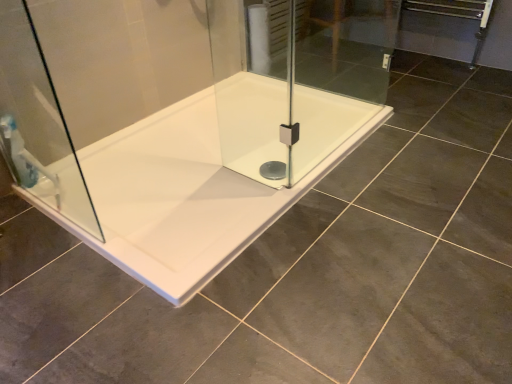
In order to face transparent glass shower door at left, should I rotate leftwards or rightwards?

You should rotate left by 28.793 degrees.

The image size is (512, 384). Describe the element at coordinates (183, 196) in the screenshot. I see `white glossy bathtub at center` at that location.

The image size is (512, 384). What do you see at coordinates (24, 158) in the screenshot?
I see `translucent plastic shower at left` at bounding box center [24, 158].

Where is `transparent glass shower door at left`? transparent glass shower door at left is located at coordinates (37, 123).

Which is behind, white glossy bathtub at center or translucent plastic shower at left?

translucent plastic shower at left is more distant.

Is point (79, 233) closer or farther from the camera than point (40, 170)?

Point (79, 233) appears to be closer to the viewer than point (40, 170).

Is white glossy bathtub at center placed right next to translucent plastic shower at left?

No, white glossy bathtub at center is not beside translucent plastic shower at left.

Find the location of a particular element. This screenshot has height=384, width=512. bathtub located on the right of translucent plastic shower at left is located at coordinates (183, 196).

Which is behind, point (330, 156) or point (44, 150)?

The point (330, 156) is behind.

Is the position of white glossy bathtub at center more distant than that of transparent glass shower door at left?

Yes, white glossy bathtub at center is behind transparent glass shower door at left.

Can you confirm if white glossy bathtub at center is smaller than transparent glass shower door at left?

No.

Considering the relative sizes of white glossy bathtub at center and transparent glass shower door at left in the image provided, is white glossy bathtub at center wider than transparent glass shower door at left?

Indeed, white glossy bathtub at center has a greater width compared to transparent glass shower door at left.

From a real-world perspective, is translucent plastic shower at left physically above white glossy bathtub at center?

Indeed, from a real-world perspective, translucent plastic shower at left stands above white glossy bathtub at center.

Does translucent plastic shower at left lie behind white glossy bathtub at center?

That is True.

Is translucent plastic shower at left next to white glossy bathtub at center and touching it?

translucent plastic shower at left is not next to white glossy bathtub at center, and they're not touching.

Could you tell me if translucent plastic shower at left is facing white glossy bathtub at center?

Yes, translucent plastic shower at left is turned towards white glossy bathtub at center.

Is translucent plastic shower at left oriented towards transparent glass shower door at left?

No, translucent plastic shower at left is not turned towards transparent glass shower door at left.

From a real-world perspective, is translucent plastic shower at left beneath transparent glass shower door at left?

Yes, from a real-world perspective, translucent plastic shower at left is below transparent glass shower door at left.

Is point (22, 149) positioned in front of point (25, 150)?

That is False.

Find the location of a particular element. shower behind the transparent glass shower door at left is located at coordinates (24, 158).

Is transparent glass shower door at left touching translucent plastic shower at left?

Yes, the surface of transparent glass shower door at left is in contact with translucent plastic shower at left.

Considering the sizes of transparent glass shower door at left and translucent plastic shower at left in the image, is transparent glass shower door at left wider or thinner than translucent plastic shower at left?

In the image, transparent glass shower door at left appears to be more narrow than translucent plastic shower at left.

This screenshot has height=384, width=512. What are the coordinates of `shower that is on the left side of transparent glass shower door at left` in the screenshot? It's located at (24, 158).

Can you confirm if transparent glass shower door at left is smaller than translucent plastic shower at left?

Incorrect, transparent glass shower door at left is not smaller in size than translucent plastic shower at left.

Is white glossy bathtub at center at the back of transparent glass shower door at left?

No, transparent glass shower door at left is not facing away from white glossy bathtub at center.

Find the location of a particular element. shower door lying above the white glossy bathtub at center (from the image's perspective) is located at coordinates (37, 123).

Is transparent glass shower door at left further to camera compared to white glossy bathtub at center?

No, it is in front of white glossy bathtub at center.

How many degrees apart are the facing directions of transparent glass shower door at left and white glossy bathtub at center?

The angle between the facing direction of transparent glass shower door at left and the facing direction of white glossy bathtub at center is 90 degrees.

Image resolution: width=512 pixels, height=384 pixels. I want to click on bathtub on the right of translucent plastic shower at left, so click(183, 196).

Locate an element on the screen. The width and height of the screenshot is (512, 384). bathtub behind the transparent glass shower door at left is located at coordinates pyautogui.click(x=183, y=196).

Considering their positions, is transparent glass shower door at left positioned closer to white glossy bathtub at center than translucent plastic shower at left?

transparent glass shower door at left.

Considering their positions, is white glossy bathtub at center positioned closer to transparent glass shower door at left than translucent plastic shower at left?

translucent plastic shower at left lies closer to transparent glass shower door at left than the other object.

Looking at the image, which one is located closer to translucent plastic shower at left, transparent glass shower door at left or white glossy bathtub at center?

The object closer to translucent plastic shower at left is transparent glass shower door at left.

Which object lies further to the anchor point transparent glass shower door at left, translucent plastic shower at left or white glossy bathtub at center?

white glossy bathtub at center.

Based on their spatial positions, is translucent plastic shower at left or transparent glass shower door at left closer to white glossy bathtub at center?

transparent glass shower door at left.

Which object lies further to the anchor point translucent plastic shower at left, white glossy bathtub at center or transparent glass shower door at left?

white glossy bathtub at center is further to translucent plastic shower at left.

You are a GUI agent. You are given a task and a screenshot of the screen. Output one action in this format:
    pyautogui.click(x=<x>, y=<y>)
    Task: Click on the shower door between translucent plastic shower at left and white glossy bathtub at center in the horizontal direction
    This screenshot has height=384, width=512.
    Given the screenshot: What is the action you would take?
    pyautogui.click(x=37, y=123)